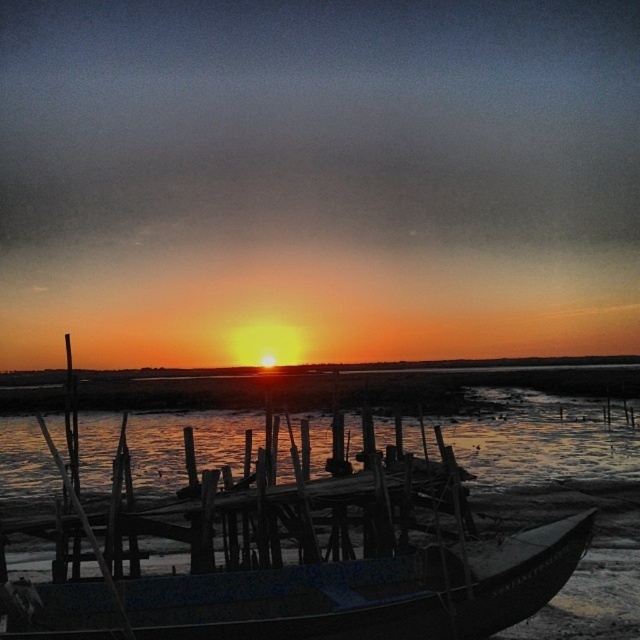
Does blue painted wood boat at lower center appear on the right side of wooden at center?

Incorrect, blue painted wood boat at lower center is not on the right side of wooden at center.

Which is behind, point (400, 625) or point (332, 525)?

The point (332, 525) is more distant.

Identify the location of blue painted wood boat at lower center. Image resolution: width=640 pixels, height=640 pixels. (368, 593).

Who is taller, translucent water at center or wooden at center?

translucent water at center is taller.

Looking at this image, who is more forward, (582, 611) or (97, 525)?

Point (582, 611)

Where is `translucent water at center`? translucent water at center is located at coordinates (564, 492).

Can you confirm if blue painted wood boat at lower center is bigger than translucent water at center?

Incorrect, blue painted wood boat at lower center is not larger than translucent water at center.

Describe the element at coordinates (368, 593) in the screenshot. I see `blue painted wood boat at lower center` at that location.

Does point (182, 612) lie behind point (19, 420)?

That is False.

Find the location of `blue painted wood boat at lower center`. blue painted wood boat at lower center is located at coordinates (368, 593).